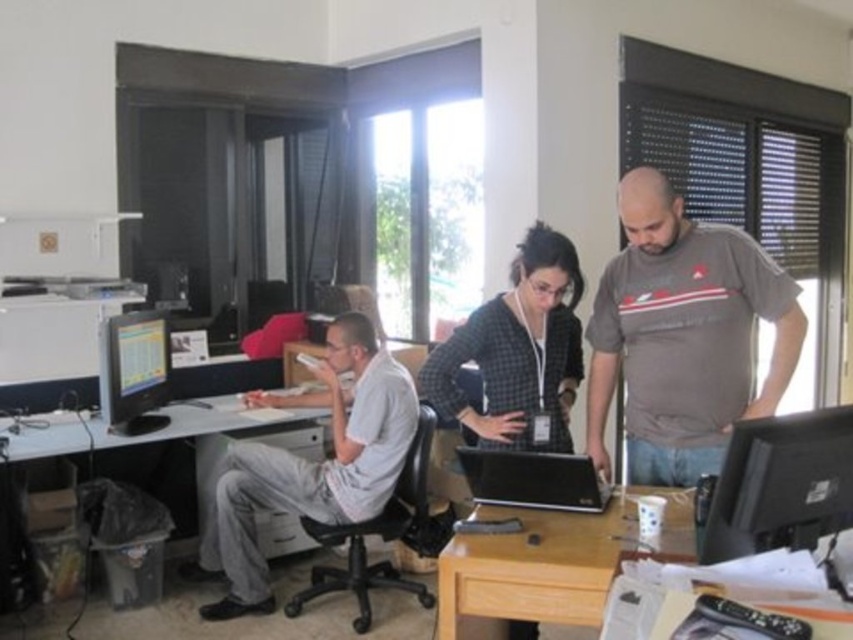
Does gray cotton t-shirt at center come in front of black glossy laptop at center?

No, it is behind black glossy laptop at center.

Can you confirm if gray cotton t-shirt at center is thinner than black glossy laptop at center?

Incorrect, gray cotton t-shirt at center's width is not less than black glossy laptop at center's.

Is point (692, 291) closer to viewer compared to point (463, 464)?

That is False.

Find the location of a particular element. gray cotton t-shirt at center is located at coordinates (683, 336).

Who is more distant from viewer, (514, 307) or (102, 444)?

Point (102, 444)

Does checkered fabric shirt at center have a lesser width compared to white glossy computer desk at lower left?

Correct, checkered fabric shirt at center's width is less than white glossy computer desk at lower left's.

Does point (461, 394) lie in front of point (163, 435)?

Yes, it is.

This screenshot has width=853, height=640. Find the location of `checkered fabric shirt at center`. checkered fabric shirt at center is located at coordinates (518, 352).

Does checkered fabric shirt at center appear on the left side of matte black monitor at left?

Incorrect, checkered fabric shirt at center is not on the left side of matte black monitor at left.

Does checkered fabric shirt at center appear over matte black monitor at left?

Yes, checkered fabric shirt at center is above matte black monitor at left.

Is point (529, 401) positioned before point (131, 392)?

Yes, point (529, 401) is in front of point (131, 392).

The width and height of the screenshot is (853, 640). What are the coordinates of `checkered fabric shirt at center` in the screenshot? It's located at (518, 352).